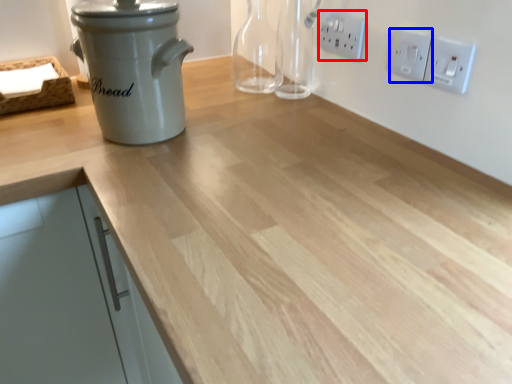
Question: Which point is further to the camera, electric outlet (highlighted by a red box) or electric outlet (highlighted by a blue box)?

Choices:
 (A) electric outlet
 (B) electric outlet

Answer: (A)